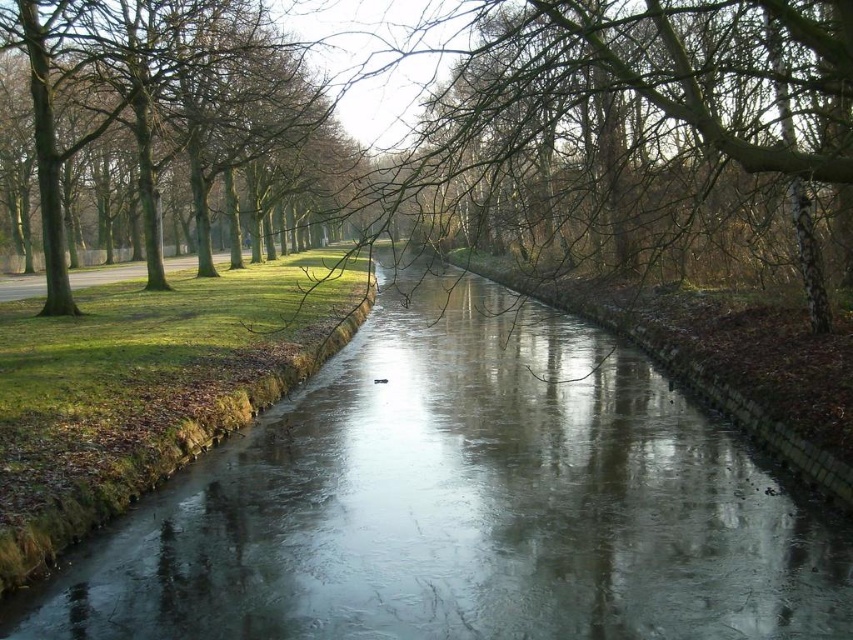
Is icy smooth river at center positioned in front of brown/dry bark tree at center?

No, it is not.

Which is more to the right, icy smooth river at center or brown/dry bark tree at center?

brown/dry bark tree at center is more to the right.

Is point (833, 620) positioned after point (846, 138)?

No, (833, 620) is in front of (846, 138).

Locate an element on the screen. icy smooth river at center is located at coordinates (463, 504).

Is point (808, 609) more distant than point (196, 42)?

No, it is not.

Does icy smooth river at center have a lesser width compared to green leafy tree at upper left?

Correct, icy smooth river at center's width is less than green leafy tree at upper left's.

Is point (276, 474) more distant than point (144, 88)?

No, it is not.

Locate an element on the screen. icy smooth river at center is located at coordinates coord(463,504).

Can you confirm if brown/dry bark tree at center is positioned to the right of green leafy tree at upper left?

Yes, brown/dry bark tree at center is to the right of green leafy tree at upper left.

At what (x,y) coordinates should I click in order to perform the action: click on brown/dry bark tree at center. Please return your answer as a coordinate pair (x, y). The width and height of the screenshot is (853, 640). Looking at the image, I should click on (646, 76).

Is point (474, 163) closer to viewer compared to point (350, 164)?

Yes, point (474, 163) is closer to viewer.

In order to click on brown/dry bark tree at center in this screenshot , I will do `click(646, 76)`.